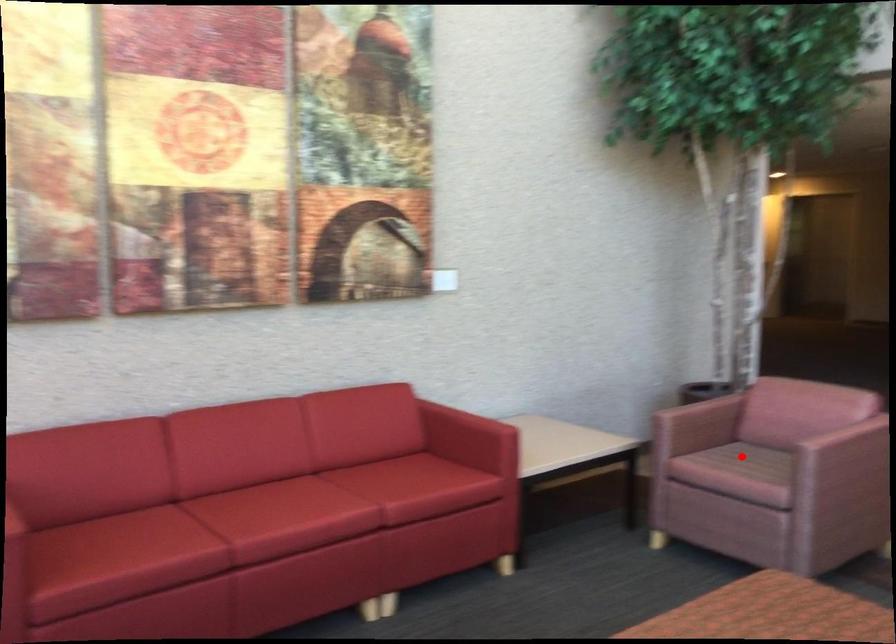
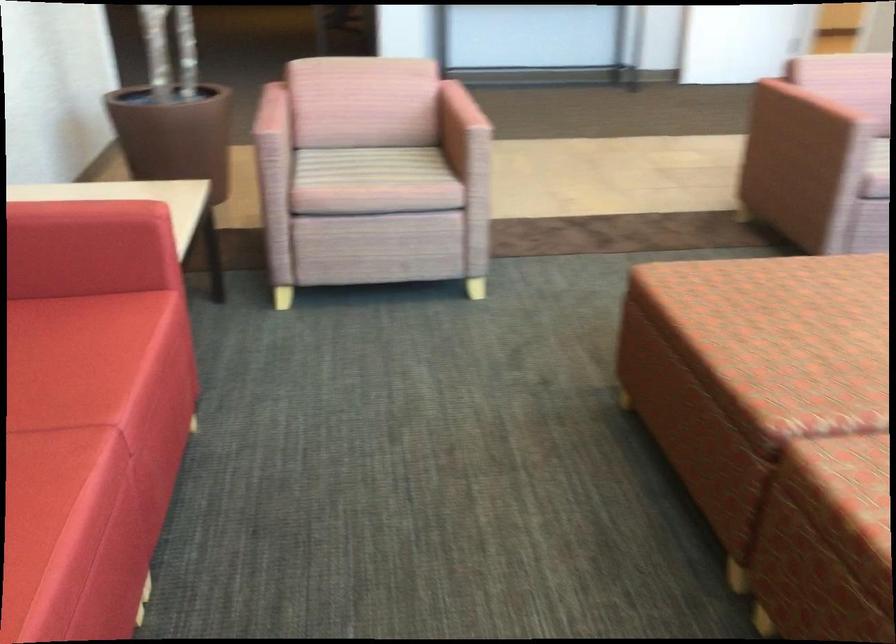
Locate, in the second image, the point that corresponds to the highlighted location in the first image.

(365, 166)